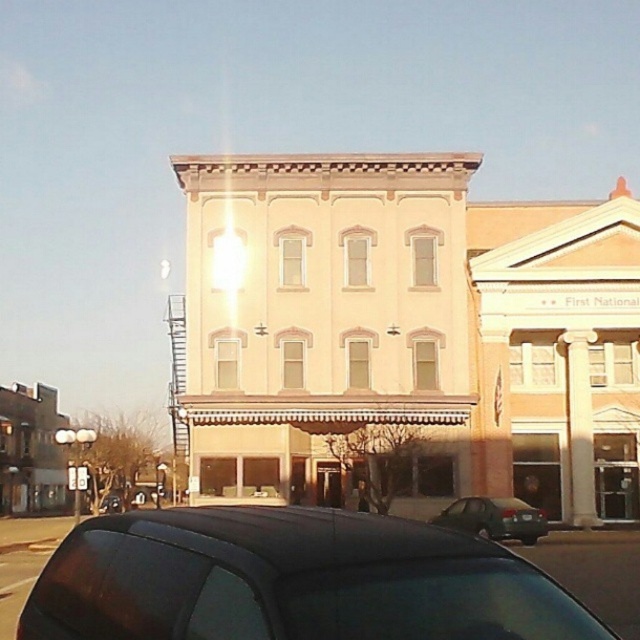
Question: Which point is closer to the camera?

Choices:
 (A) green matte sedan at lower center
 (B) black matte car at lower center

Answer: (B)

Question: Estimate the real-world distances between objects in this image. Which object is closer to the beige/smooth building at center?

Choices:
 (A) black matte car at lower center
 (B) green matte sedan at lower center

Answer: (B)

Question: Can you confirm if beige/smooth building at center is positioned to the left of black matte car at lower center?

Choices:
 (A) yes
 (B) no

Answer: (B)

Question: Does black matte car at lower center come behind green matte sedan at lower center?

Choices:
 (A) no
 (B) yes

Answer: (A)

Question: Considering the real-world distances, which object is farthest from the black matte car at lower center?

Choices:
 (A) green matte sedan at lower center
 (B) beige/smooth building at center

Answer: (B)

Question: Is beige/smooth building at center wider than black matte car at lower center?

Choices:
 (A) yes
 (B) no

Answer: (A)